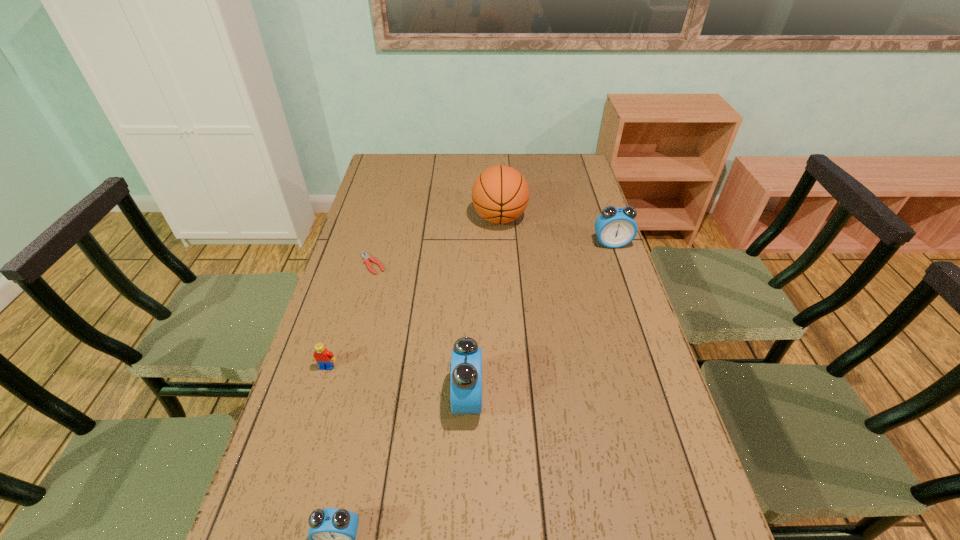
The image size is (960, 540). Find the location of `the second alarm clock from left to right`. the second alarm clock from left to right is located at coordinates (x=466, y=359).

Where is `the second nearest alarm clock`? The image size is (960, 540). the second nearest alarm clock is located at coordinates (466, 359).

Locate an element on the screen. Image resolution: width=960 pixels, height=540 pixels. the fifth nearest object is located at coordinates click(615, 227).

The height and width of the screenshot is (540, 960). Identify the location of the rightmost object. (615, 227).

The image size is (960, 540). Find the location of `Lego`. Lego is located at coordinates (324, 358).

Identify the location of the farthest object. Image resolution: width=960 pixels, height=540 pixels. (500, 194).

Image resolution: width=960 pixels, height=540 pixels. I want to click on the shortest object, so click(366, 256).

Image resolution: width=960 pixels, height=540 pixels. I want to click on the fourth nearest object, so click(366, 256).

Where is `free region located 0.090m on the face of the second alarm clock from left to right`? The width and height of the screenshot is (960, 540). free region located 0.090m on the face of the second alarm clock from left to right is located at coordinates (518, 399).

This screenshot has width=960, height=540. Identify the location of free space located on the face of the farthest alarm clock. (641, 328).